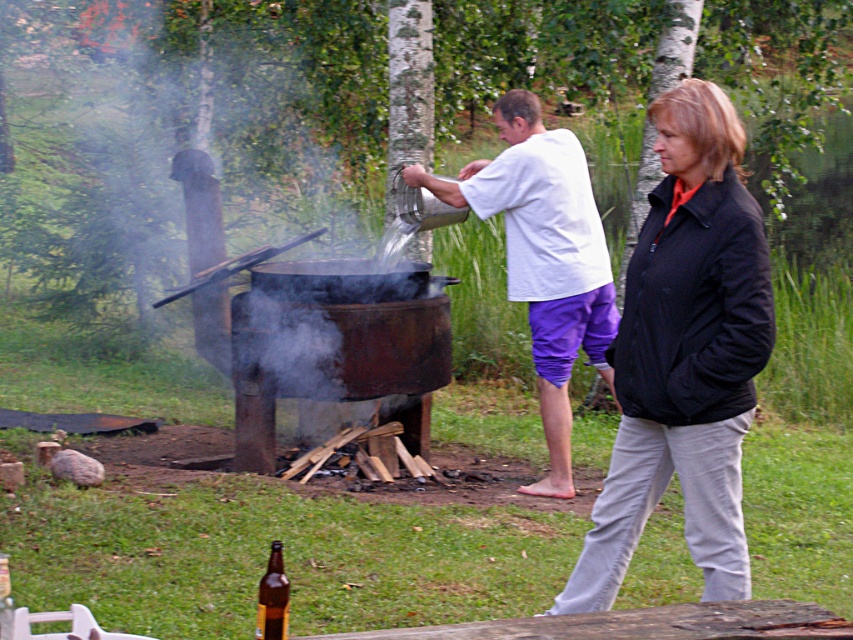
You are a photographer trying to capture the scene of the man pouring liquid into the pot. You need to ensure that both the white matte shirt at center and the brown glass bottle at lower left are clearly visible in the photo. Given their sizes, which object should you focus on to ensure both are in frame?

The white matte shirt at center has a greater height compared to the brown glass bottle at lower left, so focusing on the taller white matte shirt at center will help ensure both objects are in frame.